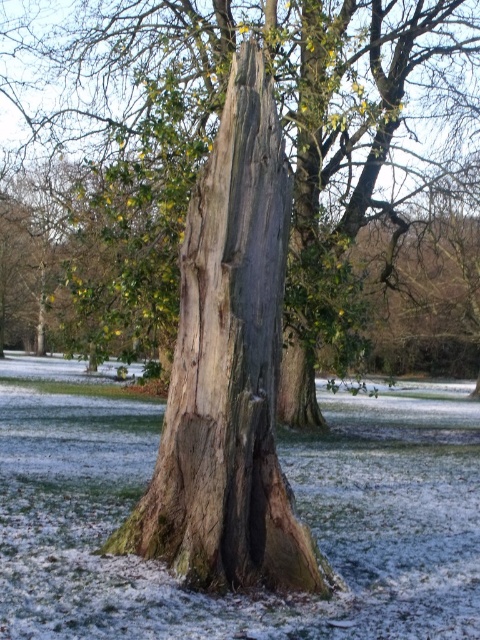
You are standing in front of the weathered tree trunk. You notice two points marked on the trunk. The first point is at coordinate location (x=436, y=74) and the second point is at (x=238, y=561). If you were to touch both points while keeping your hand at the same distance from your body, which point would require your arm to be extended more forward to reach?

Point (x=436, y=74) is further to the camera than point (x=238, y=561). Therefore, to touch point (x=436, y=74), your arm would need to be extended more forward compared to reaching point (x=238, y=561) since it is closer.

You are standing in the snowy landscape looking at the weathered tree trunk. There is a point marked at coordinates [207,150]. Based on the description, can you determine what part of the tree trunk this point is located on?

The point at coordinates [207,150] is on the smooth bark tree trunk at center, which is part of the tree trunk that hasn directly been split or damaged, as the split only affects the outer bark and exposes the inner layers.